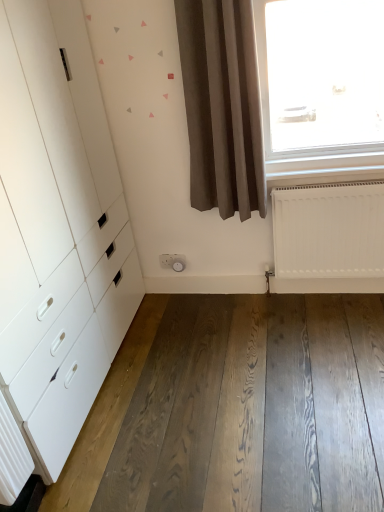
I want to click on free space above white matte radiator at lower right (from a real-world perspective), so click(x=316, y=183).